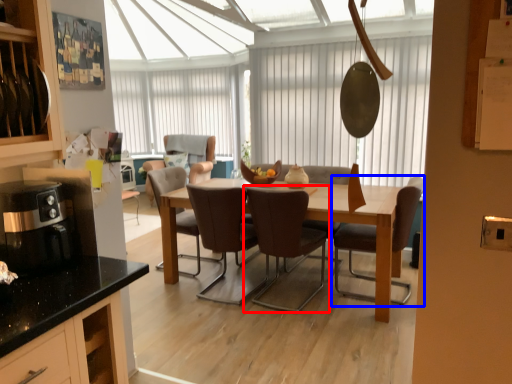
Question: Which point is closer to the camera, chair (highlighted by a red box) or chair (highlighted by a blue box)?

Choices:
 (A) chair
 (B) chair

Answer: (A)